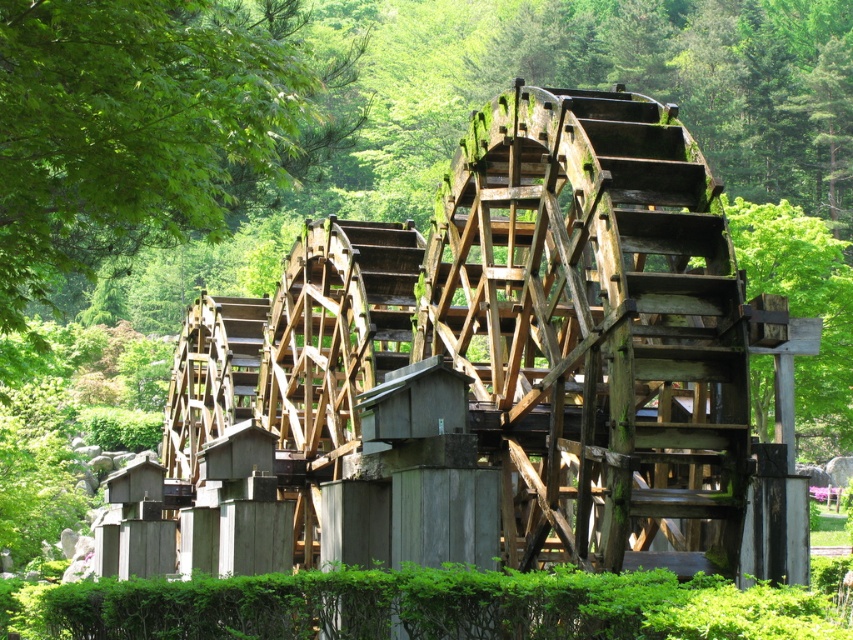
Question: Which point is closer to the camera?

Choices:
 (A) (312, 355)
 (B) (4, 17)

Answer: (B)

Question: Does green leafy tree at upper left appear on the left side of wooden waterwheel at center?

Choices:
 (A) yes
 (B) no

Answer: (A)

Question: Is green leafy tree at upper left wider than wooden waterwheel at center?

Choices:
 (A) no
 (B) yes

Answer: (B)

Question: Which of the following is the closest to the observer?

Choices:
 (A) (352, 369)
 (B) (96, 236)

Answer: (A)

Question: Can you confirm if green leafy tree at upper left is positioned to the right of wooden waterwheel at center?

Choices:
 (A) no
 (B) yes

Answer: (A)